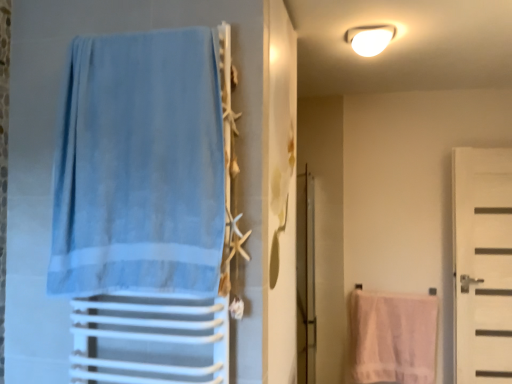
Question: Is white glossy light fixture at upper center facing away from light blue fabric towel at left?

Choices:
 (A) no
 (B) yes

Answer: (A)

Question: From a real-world perspective, is white glossy light fixture at upper center over light blue fabric towel at left?

Choices:
 (A) yes
 (B) no

Answer: (A)

Question: Is white glossy light fixture at upper center directly adjacent to light blue fabric towel at left?

Choices:
 (A) no
 (B) yes

Answer: (A)

Question: Can light blue fabric towel at left be found inside white glossy light fixture at upper center?

Choices:
 (A) no
 (B) yes

Answer: (A)

Question: Can you confirm if white glossy light fixture at upper center is bigger than light blue fabric towel at left?

Choices:
 (A) yes
 (B) no

Answer: (B)

Question: Can you confirm if white glossy light fixture at upper center is thinner than light blue fabric towel at left?

Choices:
 (A) yes
 (B) no

Answer: (B)

Question: Does white matte door at right appear on the left side of light blue fabric towel at left?

Choices:
 (A) yes
 (B) no

Answer: (B)

Question: Does white matte door at right lie behind light blue fabric towel at left?

Choices:
 (A) no
 (B) yes

Answer: (B)

Question: Is the position of white matte door at right less distant than that of light blue fabric towel at left?

Choices:
 (A) no
 (B) yes

Answer: (A)

Question: Can you confirm if white matte door at right is smaller than light blue fabric towel at left?

Choices:
 (A) no
 (B) yes

Answer: (A)

Question: Are white matte door at right and light blue fabric towel at left located far from each other?

Choices:
 (A) yes
 (B) no

Answer: (A)

Question: Is white matte door at right touching light blue fabric towel at left?

Choices:
 (A) yes
 (B) no

Answer: (B)

Question: From the image's perspective, would you say clear glass screen door at center is positioned over white matte door at right?

Choices:
 (A) yes
 (B) no

Answer: (B)